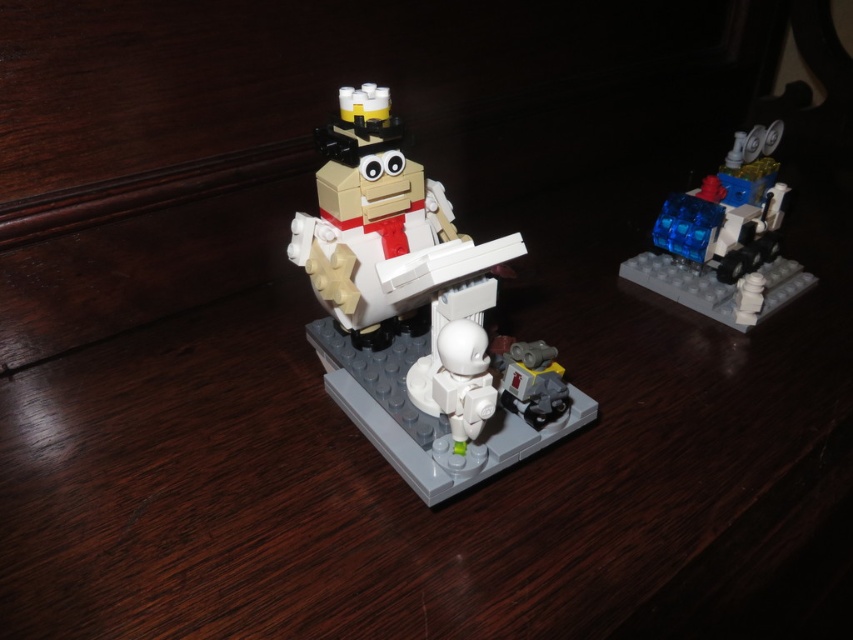
Question: Is matte plastic astronaut at center positioned at the back of transparent blue plastic at upper right?

Choices:
 (A) no
 (B) yes

Answer: (A)

Question: From the image, what is the correct spatial relationship of matte plastic astronaut at center in relation to transparent blue plastic at upper right?

Choices:
 (A) above
 (B) below

Answer: (B)

Question: Among these points, which one is farthest from the camera?

Choices:
 (A) (412, 202)
 (B) (717, 268)

Answer: (B)

Question: Which of the following is the farthest from the observer?

Choices:
 (A) transparent blue plastic at upper right
 (B) matte plastic astronaut at center

Answer: (A)

Question: Is matte plastic astronaut at center further to camera compared to transparent blue plastic at upper right?

Choices:
 (A) no
 (B) yes

Answer: (A)

Question: Which of the following is the closest to the observer?

Choices:
 (A) matte plastic astronaut at center
 (B) transparent blue plastic at upper right

Answer: (A)